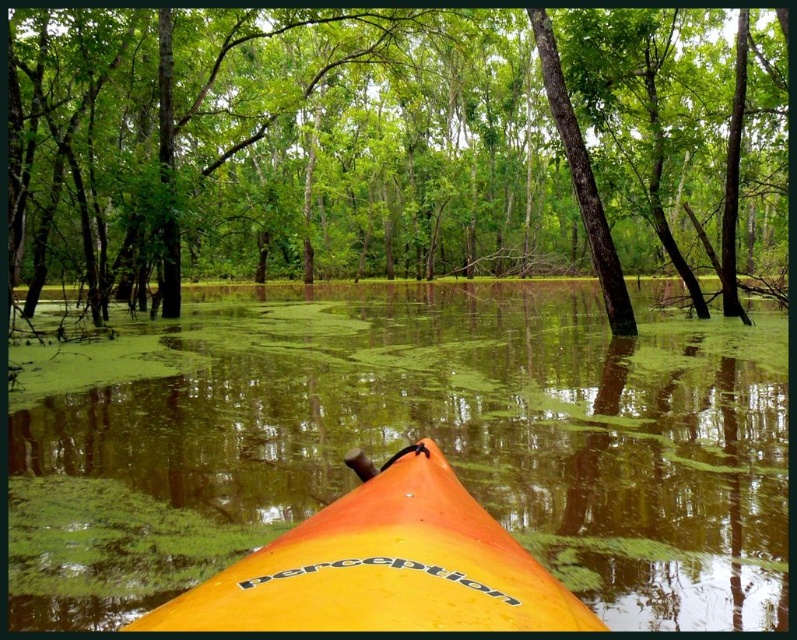
You are in a kayak and want to reach a point marked at coordinates point (538, 300). The kayak can travel at 2.5 feet per second. How many seconds will it take to reach the point?

The distance between you and point (538, 300) is 95.51 feet. At a speed of 2.5 feet per second, it will take approximately 38.2 seconds to reach the point.

You are kayaking and want to know which tree is bigger between the green leafy tree at center and the green rough bark tree at center. Which one is larger?

The green leafy tree at center is larger in size than the green rough bark tree at center.

You are in a kayak and want to avoid the green algae water at center. Which direction should you paddle to move away from it?

Since the green algae water at center is located at point (406,442), you should paddle in the opposite direction to move away from it.